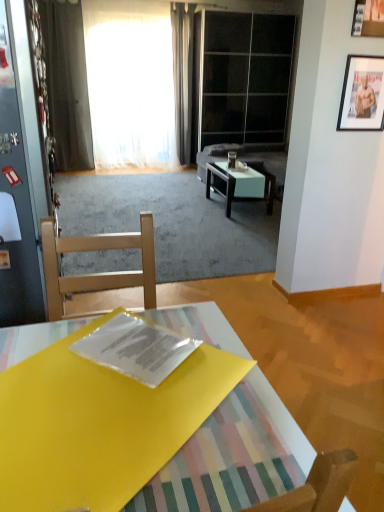
The height and width of the screenshot is (512, 384). Describe the element at coordinates (241, 184) in the screenshot. I see `white glossy coffee table at center, the first coffee table when ordered from back to front` at that location.

Describe the element at coordinates (20, 175) in the screenshot. I see `metallic glass door at left, the second glass door viewed from the back` at that location.

What is the approximate width of wooden picture frame at upper right, the 1th picture frame from the top?

It is 1.19 inches.

Locate an element on the screen. This screenshot has width=384, height=512. transparent glass door at upper center, the 1th glass door in the right-to-left sequence is located at coordinates (245, 77).

Image resolution: width=384 pixels, height=512 pixels. I want to click on gray fabric curtain at upper center, the second curtain from the left, so click(183, 76).

You are a GUI agent. You are given a task and a screenshot of the screen. Output one action in this format:
    pyautogui.click(x=<x>, y=<y>)
    Task: Click on the white glossy coffee table at center, placed as the 1th coffee table when sorted from top to bottom
    Image resolution: width=384 pixels, height=512 pixels.
    Given the screenshot: What is the action you would take?
    pyautogui.click(x=241, y=184)

Is suede gray couch at center located outside metallic silver picture frame at upper right, placed as the second picture frame when sorted from front to back?

Yes, suede gray couch at center is not within metallic silver picture frame at upper right, placed as the second picture frame when sorted from front to back.

From a real-world perspective, is suede gray couch at center physically located above or below metallic silver picture frame at upper right, which ranks as the 2th picture frame in top-to-bottom order?

suede gray couch at center is situated lower than metallic silver picture frame at upper right, which ranks as the 2th picture frame in top-to-bottom order, in the real world.

Considering the positions of objects suede gray couch at center and metallic silver picture frame at upper right, which ranks as the 2th picture frame in top-to-bottom order, in the image provided, who is more to the right, suede gray couch at center or metallic silver picture frame at upper right, which ranks as the 2th picture frame in top-to-bottom order,?

Positioned to the right is metallic silver picture frame at upper right, which ranks as the 2th picture frame in top-to-bottom order.

From the image's perspective, who appears lower, suede gray couch at center or metallic silver picture frame at upper right, positioned as the first picture frame in back-to-front order?

metallic silver picture frame at upper right, positioned as the first picture frame in back-to-front order, appears lower in the image.

Which of these two, white sheer curtain at upper center, which appears as the 1th curtain when viewed from the left, or suede gray couch at center, is wider?

suede gray couch at center is wider.

I want to click on the 1st curtain positioned above the suede gray couch at center (from the image's perspective), so point(130,83).

Who is shorter, white sheer curtain at upper center, which appears as the 1th curtain when viewed from the left, or suede gray couch at center?

Standing shorter between the two is suede gray couch at center.

From the image's perspective, does white sheer curtain at upper center, marked as the 2th curtain in a right-to-left arrangement, appear lower than suede gray couch at center?

No.

Would you consider gray fabric curtain at upper center, the second curtain from the left, to be distant from metallic silver picture frame at upper right, placed as the second picture frame when sorted from front to back?

Yes.

From the image's perspective, between gray fabric curtain at upper center, the second curtain from the left, and metallic silver picture frame at upper right, positioned as the first picture frame in back-to-front order, which one is located above?

gray fabric curtain at upper center, the second curtain from the left, from the image's perspective.

Is gray fabric curtain at upper center, marked as the 1th curtain in a right-to-left arrangement, closer to the viewer compared to metallic silver picture frame at upper right, placed as the second picture frame when sorted from front to back?

No, it is not.

Which is in front, point (187, 143) or point (366, 106)?

The point (366, 106) is closer to the camera.

In the image, is transparent plastic magazine at center on the left side or the right side of white glossy coffee table at center, which appears as the second coffee table when viewed from the left?

Based on their positions, transparent plastic magazine at center is located to the left of white glossy coffee table at center, which appears as the second coffee table when viewed from the left.

Would you say white glossy coffee table at center, placed as the second coffee table when sorted from front to back, is part of transparent plastic magazine at center's contents?

Actually, white glossy coffee table at center, placed as the second coffee table when sorted from front to back, is outside transparent plastic magazine at center.

Relative to white glossy coffee table at center, placed as the second coffee table when sorted from front to back, is transparent plastic magazine at center in front or behind?

In the image, transparent plastic magazine at center appears in front of white glossy coffee table at center, placed as the second coffee table when sorted from front to back.

Could you tell me if transparent plastic magazine at center is turned towards white glossy coffee table at center, the 2th coffee table in the bottom-to-top sequence?

No, transparent plastic magazine at center does not turn towards white glossy coffee table at center, the 2th coffee table in the bottom-to-top sequence.

Is suede gray couch at center turned away from white glossy coffee table at center, the first coffee table when ordered from back to front?

That's not correct — suede gray couch at center is not looking away from white glossy coffee table at center, the first coffee table when ordered from back to front.

Does suede gray couch at center have a larger size compared to white glossy coffee table at center, the 2th coffee table in the bottom-to-top sequence?

Indeed, suede gray couch at center has a larger size compared to white glossy coffee table at center, the 2th coffee table in the bottom-to-top sequence.

Is suede gray couch at center inside or outside of white glossy coffee table at center, placed as the 1th coffee table when sorted from top to bottom?

suede gray couch at center is spatially situated outside white glossy coffee table at center, placed as the 1th coffee table when sorted from top to bottom.

Locate an element on the screen. coffee table that is the 1st object located below the suede gray couch at center (from the image's perspective) is located at coordinates (241, 184).

From a real-world perspective, which object rests below the other?

suede gray couch at center, from a real-world perspective.

Considering the sizes of objects suede gray couch at center and transparent plastic magazine at center in the image provided, who is taller, suede gray couch at center or transparent plastic magazine at center?

Standing taller between the two is suede gray couch at center.

Which object is thinner, suede gray couch at center or transparent plastic magazine at center?

transparent plastic magazine at center.

From the image's perspective, is suede gray couch at center positioned above or below transparent plastic magazine at center?

Clearly, from the image's perspective, suede gray couch at center is above transparent plastic magazine at center.

How many degrees apart are the facing directions of transparent glass door at upper center, marked as the 1th glass door in a top-to-bottom arrangement, and yellow plastic folder at center, placed as the 1th coffee table when sorted from left to right?

179 degrees separate the facing orientations of transparent glass door at upper center, marked as the 1th glass door in a top-to-bottom arrangement, and yellow plastic folder at center, placed as the 1th coffee table when sorted from left to right.

Can you confirm if transparent glass door at upper center, the 1th glass door in the right-to-left sequence, is positioned to the left of yellow plastic folder at center, the second coffee table positioned from the back?

No.

Which of these two, transparent glass door at upper center, marked as the 1th glass door in a top-to-bottom arrangement, or yellow plastic folder at center, which is counted as the 1th coffee table, starting from the front, stands shorter?

Standing shorter between the two is yellow plastic folder at center, which is counted as the 1th coffee table, starting from the front.

The height and width of the screenshot is (512, 384). I want to click on couch that is behind the metallic silver picture frame at upper right, positioned as the first picture frame in back-to-front order, so click(x=248, y=159).

Starting from the suede gray couch at center, which curtain is the 2nd one to the left? Please provide its 2D coordinates.

[(130, 83)]

In the scene shown: Based on their spatial positions, is yellow plastic folder at center, which is counted as the 1th coffee table, starting from the front, or white sheer curtain at upper center, which appears as the 1th curtain when viewed from the left, closer to metallic glass door at left, acting as the 2th glass door starting from the right?

Based on the image, yellow plastic folder at center, which is counted as the 1th coffee table, starting from the front, appears to be nearer to metallic glass door at left, acting as the 2th glass door starting from the right.

From the picture: Looking at the image, which one is located further to white glossy coffee table at center, the first coffee table when ordered from back to front, suede gray couch at center or white sheer curtain at upper center, marked as the 2th curtain in a right-to-left arrangement?

white sheer curtain at upper center, marked as the 2th curtain in a right-to-left arrangement.

Estimate the real-world distances between objects in this image. Which object is further from wooden picture frame at upper right, which ranks as the first picture frame in front-to-back order, suede gray couch at center or transparent plastic magazine at center?

suede gray couch at center is further to wooden picture frame at upper right, which ranks as the first picture frame in front-to-back order.

Based on the photo, from the image, which object appears to be nearer to suede gray couch at center, wooden picture frame at upper right, which ranks as the first picture frame in front-to-back order, or metallic silver picture frame at upper right, positioned as the first picture frame in back-to-front order?

The object closer to suede gray couch at center is metallic silver picture frame at upper right, positioned as the first picture frame in back-to-front order.

Estimate the real-world distances between objects in this image. Which object is further from metallic silver picture frame at upper right, placed as the second picture frame when sorted from front to back, yellow plastic folder at center, which appears as the second coffee table when viewed from the top, or white glossy coffee table at center, the 2th coffee table in the bottom-to-top sequence?

The object further to metallic silver picture frame at upper right, placed as the second picture frame when sorted from front to back, is white glossy coffee table at center, the 2th coffee table in the bottom-to-top sequence.

Which object lies nearer to the anchor point gray fabric curtain at upper center, marked as the 1th curtain in a right-to-left arrangement, white glossy coffee table at center, the first coffee table when ordered from back to front, or wooden picture frame at upper right, the 1th picture frame from the top?

white glossy coffee table at center, the first coffee table when ordered from back to front, is positioned closer to the anchor gray fabric curtain at upper center, marked as the 1th curtain in a right-to-left arrangement.

From the image, which object appears to be farther from transparent glass door at upper center, which is the first glass door in back-to-front order, white glossy coffee table at center, which ranks as the 1th coffee table in right-to-left order, or transparent plastic magazine at center?

transparent plastic magazine at center is positioned further to the anchor transparent glass door at upper center, which is the first glass door in back-to-front order.

Estimate the real-world distances between objects in this image. Which object is closer to suede gray couch at center, yellow plastic folder at center, the second coffee table positioned from the back, or transparent plastic magazine at center?

transparent plastic magazine at center lies closer to suede gray couch at center than the other object.

Where is `glass door between gray fabric curtain at upper center, marked as the 1th curtain in a right-to-left arrangement, and white glossy coffee table at center, which ranks as the 1th coffee table in right-to-left order, from top to bottom`? This screenshot has width=384, height=512. glass door between gray fabric curtain at upper center, marked as the 1th curtain in a right-to-left arrangement, and white glossy coffee table at center, which ranks as the 1th coffee table in right-to-left order, from top to bottom is located at coordinates (245, 77).

This screenshot has width=384, height=512. I want to click on glass door between metallic silver picture frame at upper right, positioned as the first picture frame in back-to-front order, and gray fabric curtain at upper center, the second curtain from the left, along the z-axis, so pos(245,77).

Locate an element on the screen. curtain located between metallic silver picture frame at upper right, placed as the second picture frame when sorted from front to back, and transparent glass door at upper center, marked as the 1th glass door in a top-to-bottom arrangement, in the depth direction is located at coordinates (130, 83).

Find the location of a particular element. This screenshot has width=384, height=512. curtain positioned between metallic glass door at left, which ranks as the first glass door in front-to-back order, and transparent glass door at upper center, marked as the 1th glass door in a top-to-bottom arrangement, from near to far is located at coordinates (130, 83).